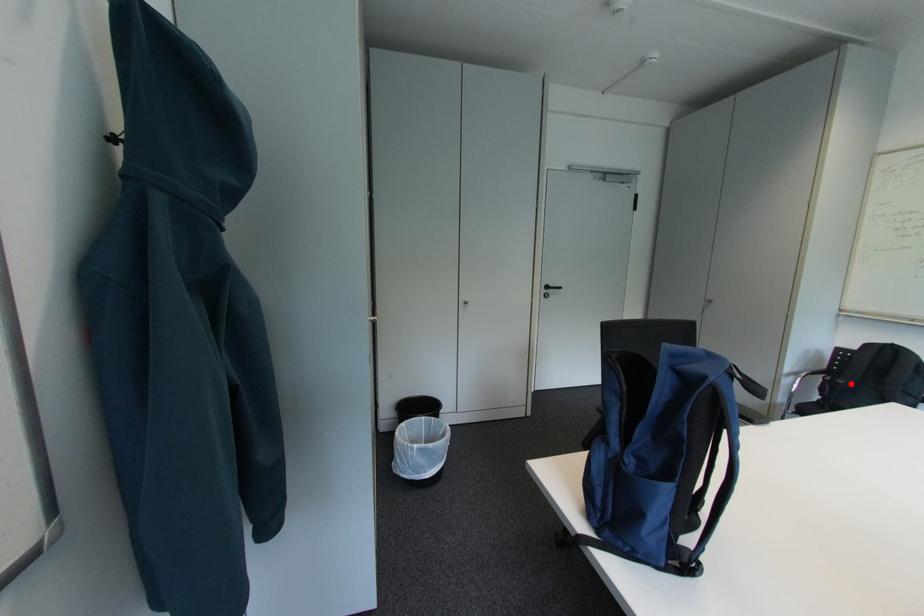
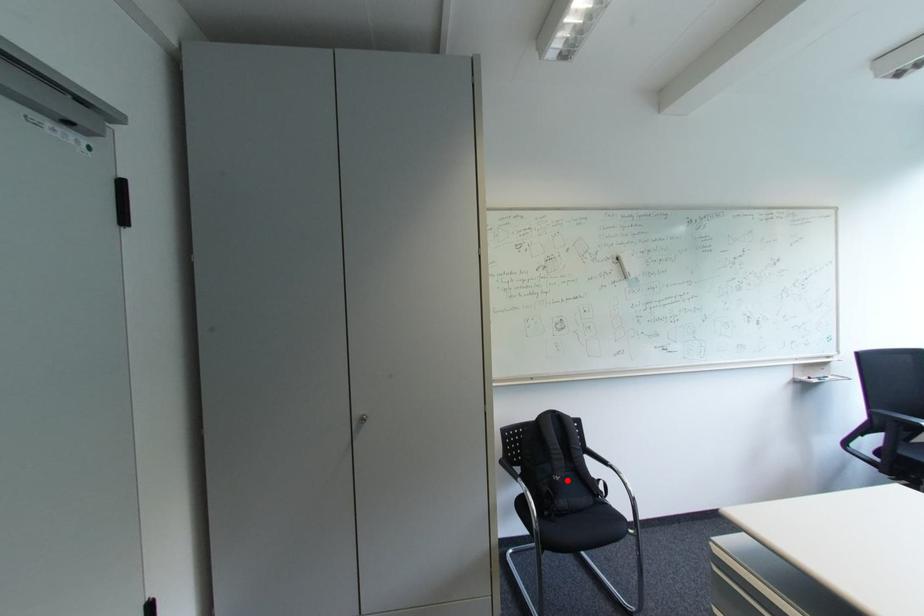
I am providing you with two images of the same scene from different viewpoints. A red point is marked on the first image and another point is marked on the second image. Does the point marked in image1 correspond to the same location as the one in image2?

Yes